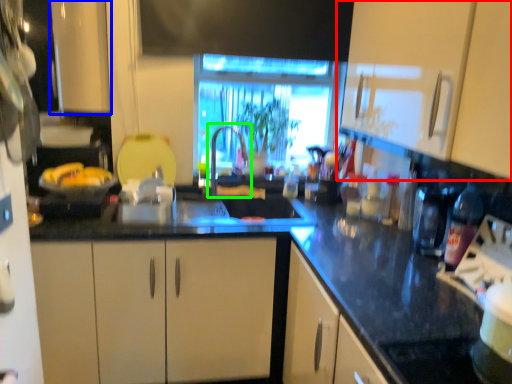
Question: Which object is positioned farthest from cabinetry (highlighted by a red box)? Select from cabinetry (highlighted by a blue box) and faucet (highlighted by a green box).

Choices:
 (A) cabinetry
 (B) faucet

Answer: (A)